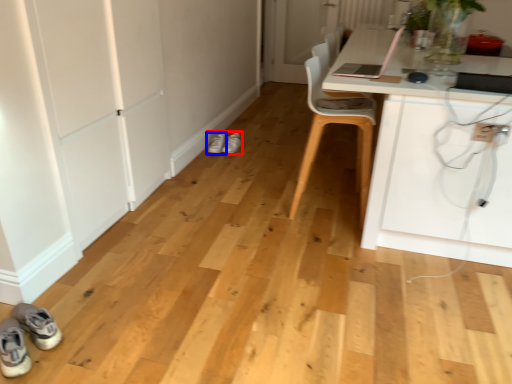
Question: Which object appears farthest to the camera in this image, footwear (highlighted by a red box) or footwear (highlighted by a blue box)?

Choices:
 (A) footwear
 (B) footwear

Answer: (A)